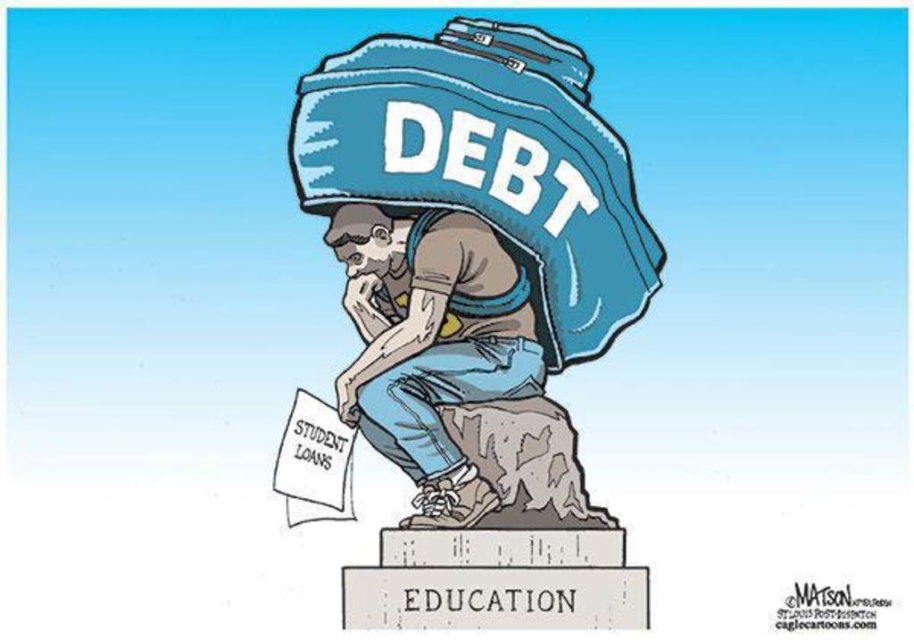
Is point (638, 300) positioned before point (444, 288)?

No, (638, 300) is further to viewer.

Measure the distance between point (543, 72) and camera.

Point (543, 72) is 82.32 meters away from camera.

Does point (392, 184) come behind point (543, 368)?

No, it is not.

Find the location of a particular element. blue fabric bag at center is located at coordinates (471, 252).